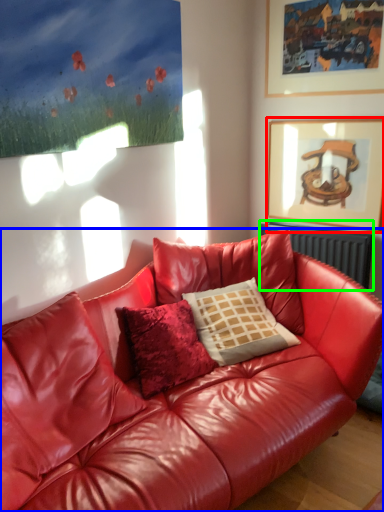
Question: Which object is positioned closest to picture frame (highlighted by a red box)? Select from studio couch (highlighted by a blue box) and radiator (highlighted by a green box).

Choices:
 (A) studio couch
 (B) radiator

Answer: (B)